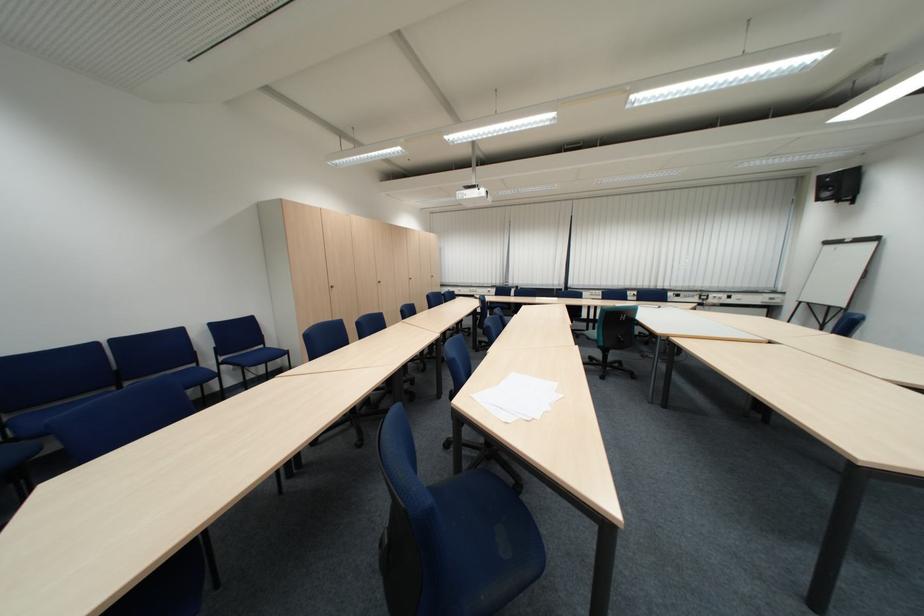
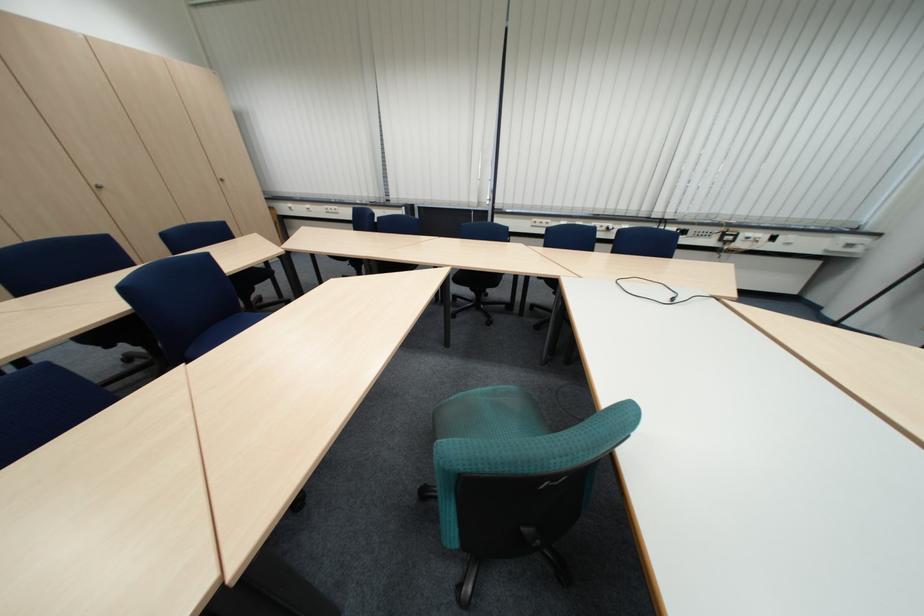
Where in the second image is the point corresponding to point 725,296 from the first image?

(759, 235)